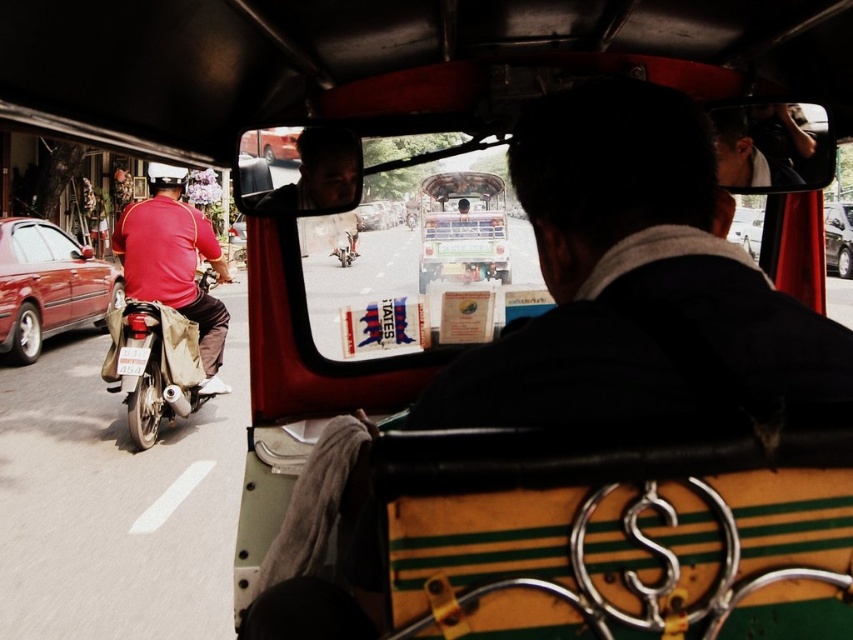
Question: Can you confirm if shiny red car at left is positioned to the right of matte red motorcycle at left?

Choices:
 (A) no
 (B) yes

Answer: (A)

Question: Which of the following is the farthest from the observer?

Choices:
 (A) (656, 296)
 (B) (837, 218)

Answer: (B)

Question: Which point appears closest to the camera in this image?

Choices:
 (A) (843, 237)
 (B) (187, 339)
 (C) (167, 252)
 (D) (335, 240)

Answer: (D)

Question: Observing the image, what is the correct spatial positioning of shiny red car at left in reference to matte red motorcycle at left?

Choices:
 (A) right
 (B) left

Answer: (B)

Question: Can you confirm if red matte motorcycle at left is positioned below shiny chrome motorcycle at center?

Choices:
 (A) yes
 (B) no

Answer: (A)

Question: Which object is positioned farthest from the matte red motorcycle at left?

Choices:
 (A) dark blue jacket at center
 (B) shiny chrome motorcycle at center
 (C) metallic silver car at right

Answer: (C)